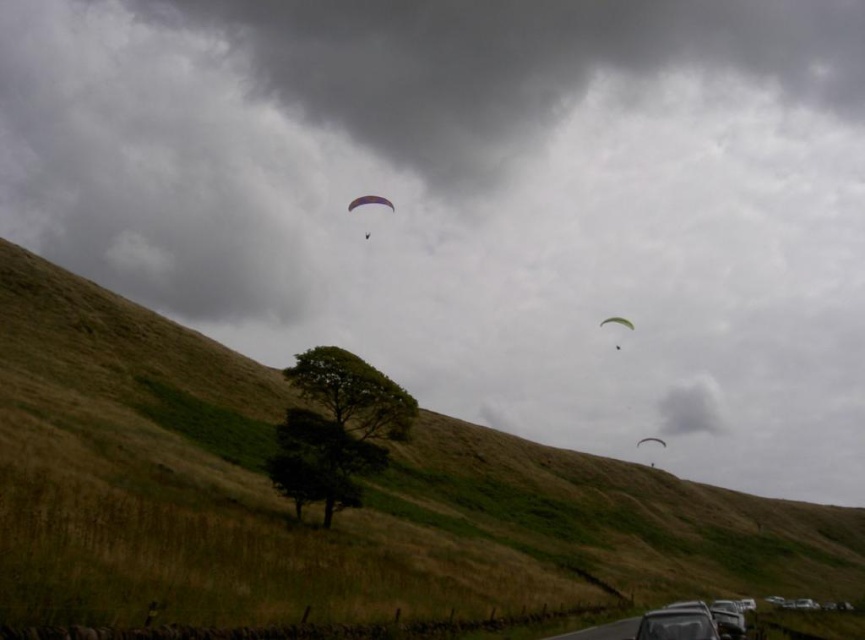
Based on the photo, who is positioned more to the right, green grassy hillside at center or silver metallic car at lower right?

green grassy hillside at center

Is green grassy hillside at center closer to the viewer compared to silver metallic car at lower right?

Yes, it is in front of silver metallic car at lower right.

Describe the element at coordinates (335, 515) in the screenshot. The image size is (865, 640). I see `green grassy hillside at center` at that location.

This screenshot has width=865, height=640. In order to click on green grassy hillside at center in this screenshot , I will do `click(335, 515)`.

Is purple fabric parachute at center to the right of white matte parachute at center from the viewer's perspective?

Incorrect, purple fabric parachute at center is not on the right side of white matte parachute at center.

Who is more forward, (353, 204) or (632, 323)?

Point (353, 204)

Is point (351, 205) more distant than point (610, 317)?

Yes, point (351, 205) is farther from viewer.

You are a GUI agent. You are given a task and a screenshot of the screen. Output one action in this format:
    pyautogui.click(x=<x>, y=<y>)
    Task: Click on the purple fabric parachute at center
    
    Given the screenshot: What is the action you would take?
    pyautogui.click(x=369, y=202)

This screenshot has width=865, height=640. What do you see at coordinates (727, 618) in the screenshot? I see `silver metallic car at lower right` at bounding box center [727, 618].

Does point (735, 620) come closer to viewer compared to point (389, 208)?

Yes, it is.

Is point (741, 627) less distant than point (364, 234)?

Yes, point (741, 627) is in front of point (364, 234).

Image resolution: width=865 pixels, height=640 pixels. I want to click on silver metallic car at lower right, so click(727, 618).